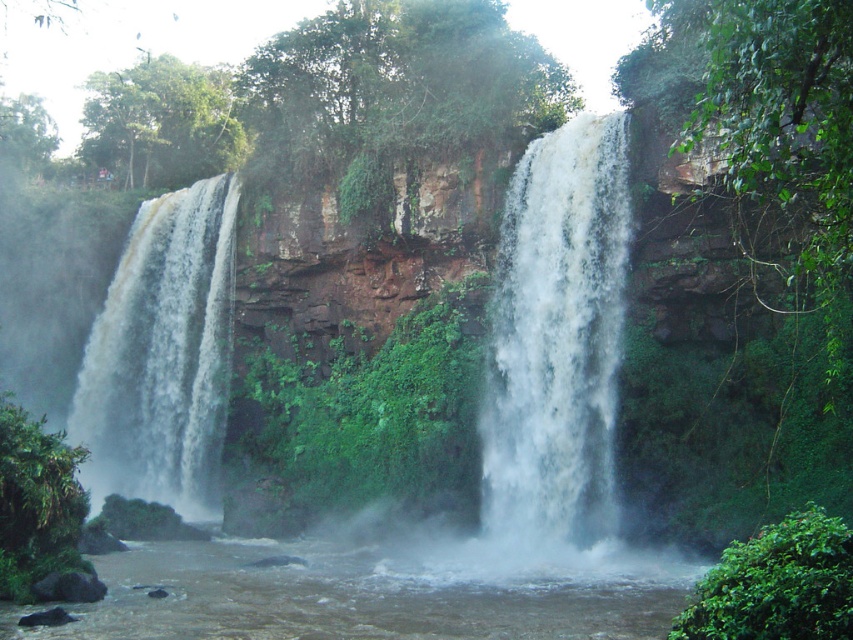
Question: Which point is closer to the camera?

Choices:
 (A) white frothy water at center
 (B) brown muddy water at lower center
 (C) white frothy water at left

Answer: (B)

Question: Does brown muddy water at lower center come in front of white frothy water at center?

Choices:
 (A) no
 (B) yes

Answer: (B)

Question: Among these points, which one is farthest from the camera?

Choices:
 (A) (212, 182)
 (B) (521, 532)
 (C) (251, 595)

Answer: (A)

Question: Does white frothy water at center appear under white frothy water at left?

Choices:
 (A) yes
 (B) no

Answer: (B)

Question: Among these objects, which one is nearest to the camera?

Choices:
 (A) white frothy water at center
 (B) brown muddy water at lower center
 (C) white frothy water at left

Answer: (B)

Question: Does brown muddy water at lower center appear on the left side of white frothy water at left?

Choices:
 (A) no
 (B) yes

Answer: (A)